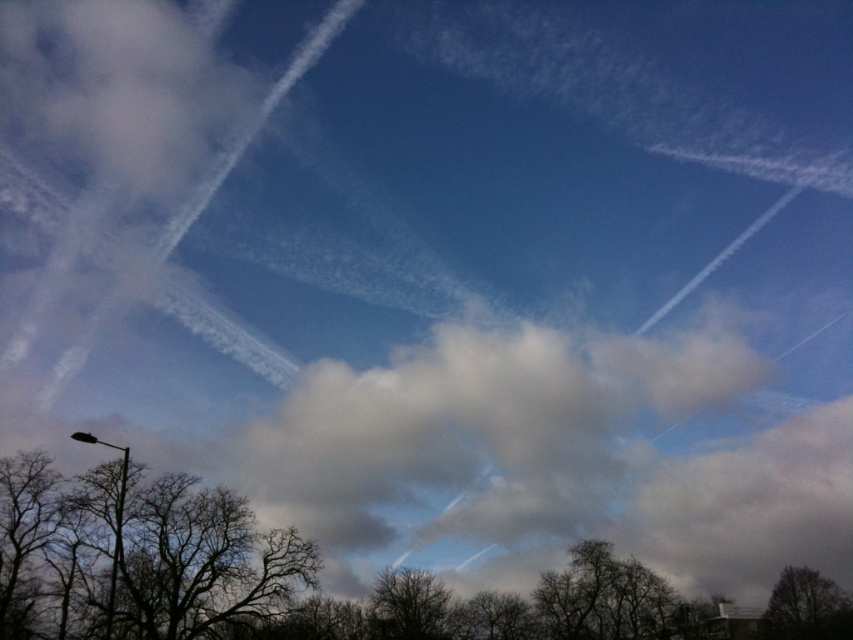
Question: Does dark brown textured tree at lower center have a larger size compared to black metal lamp post at lower left?

Choices:
 (A) yes
 (B) no

Answer: (B)

Question: Which point is closer to the camera?

Choices:
 (A) dark brown textured tree at lower right
 (B) dark brown textured tree at lower center

Answer: (B)

Question: Which point is closer to the camera taking this photo?

Choices:
 (A) (399, 621)
 (B) (112, 589)

Answer: (B)

Question: Can you confirm if dark brown textured tree at lower center is positioned above black metal lamp post at lower left?

Choices:
 (A) yes
 (B) no

Answer: (B)

Question: Is dark brown textured tree at lower right smaller than black metal lamp post at lower left?

Choices:
 (A) yes
 (B) no

Answer: (A)

Question: Which point is closer to the camera?

Choices:
 (A) black metal lamp post at lower left
 (B) dark brown textured tree at lower center

Answer: (A)